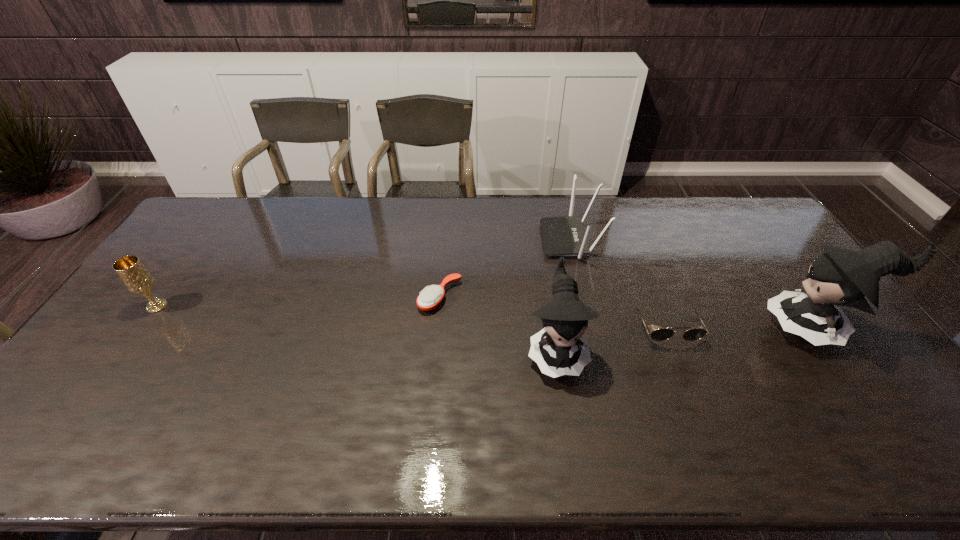
Where is `free location that satisfies the following two spatial constraints: 1. at the face of the taller doll; 2. at the face of the left doll`? free location that satisfies the following two spatial constraints: 1. at the face of the taller doll; 2. at the face of the left doll is located at coordinates (831, 349).

The height and width of the screenshot is (540, 960). I want to click on vacant space that satisfies the following two spatial constraints: 1. at the face of the right doll; 2. at the face of the left doll, so click(x=831, y=349).

What are the coordinates of `vacant region that satisfies the following two spatial constraints: 1. on the front-facing side of the farthest object; 2. on the front side of the chalice` in the screenshot? It's located at (586, 306).